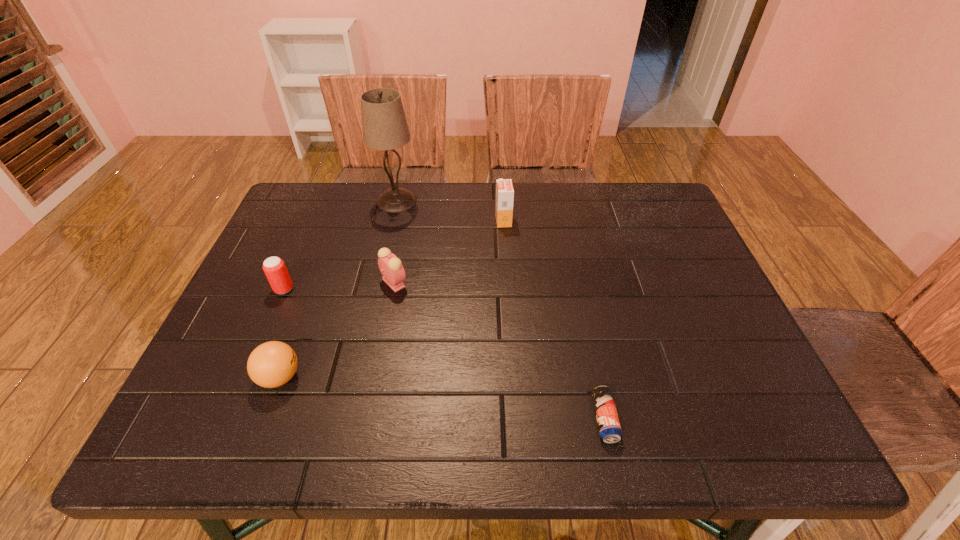
Locate an element on the screen. The width and height of the screenshot is (960, 540). the farthest object is located at coordinates (384, 123).

Where is `lampshade`? Image resolution: width=960 pixels, height=540 pixels. lampshade is located at coordinates (384, 123).

The height and width of the screenshot is (540, 960). I want to click on the fifth object from left to right, so click(x=504, y=188).

You are a GUI agent. You are given a task and a screenshot of the screen. Output one action in this format:
    pyautogui.click(x=<x>, y=<y>)
    Task: Click on the orange juice
    Image resolution: width=960 pixels, height=540 pixels.
    Given the screenshot: What is the action you would take?
    pyautogui.click(x=504, y=188)

This screenshot has height=540, width=960. Identify the location of alarm clock. (391, 268).

At what (x,y) coordinates should I click in order to perform the action: click on the farther beer can. Please return your answer as a coordinate pair (x, y). The image size is (960, 540). Looking at the image, I should click on (274, 267).

The width and height of the screenshot is (960, 540). I want to click on the left beer can, so click(274, 267).

Locate an element on the screen. This screenshot has width=960, height=540. ping-pong ball is located at coordinates coord(272,364).

In order to click on the right beer can in this screenshot , I will do `click(609, 427)`.

This screenshot has width=960, height=540. I want to click on the shorter beer can, so click(609, 427).